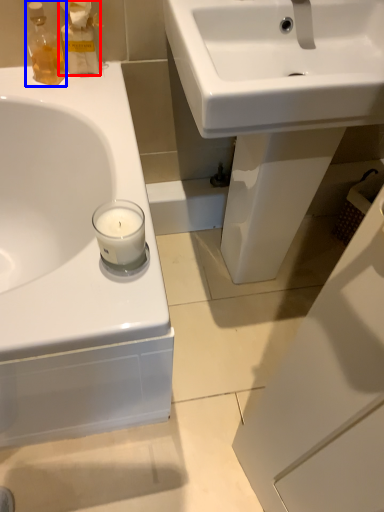
Question: Which object is further to the camera taking this photo, cleaning product (highlighted by a red box) or toiletry (highlighted by a blue box)?

Choices:
 (A) cleaning product
 (B) toiletry

Answer: (A)